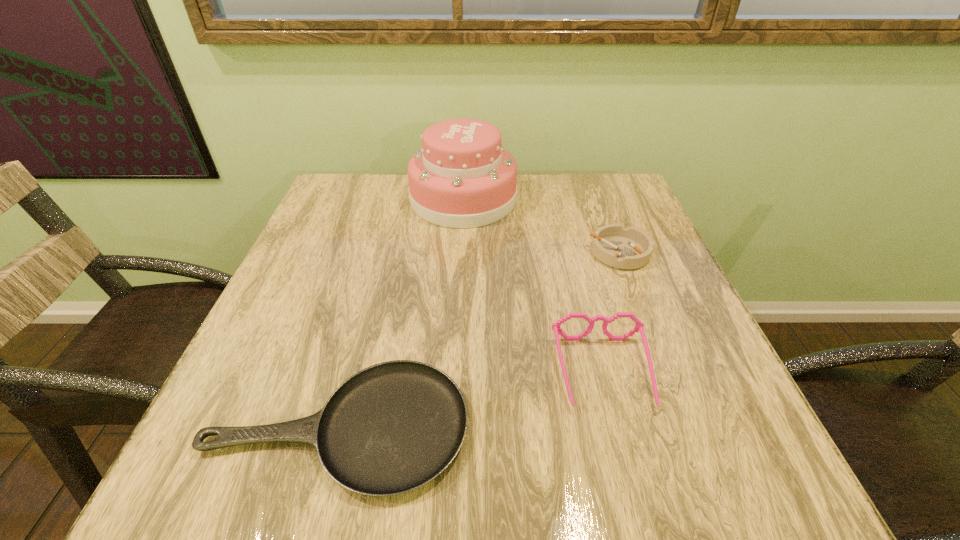
Where is `object that is at the far edge`? object that is at the far edge is located at coordinates (463, 177).

Locate an element on the screen. The height and width of the screenshot is (540, 960). object that is at the near edge is located at coordinates (391, 428).

Where is `object positioned at the left edge`? object positioned at the left edge is located at coordinates (391, 428).

You are a GUI agent. You are given a task and a screenshot of the screen. Output one action in this format:
    pyautogui.click(x=<x>, y=<y>)
    Task: Click on the spectacles that is positioned at the right edge
    
    Given the screenshot: What is the action you would take?
    pyautogui.click(x=639, y=326)

Locate an element on the screen. The width and height of the screenshot is (960, 540). ashtray present at the right edge is located at coordinates (625, 248).

What are the coordinates of `object situated at the near left corner` in the screenshot? It's located at (391, 428).

This screenshot has width=960, height=540. I want to click on vacant point at the far edge, so click(520, 207).

Identify the location of vacant point at the near edge. This screenshot has width=960, height=540. (300, 468).

What are the coordinates of `free spot at the left edge of the desktop` in the screenshot? It's located at (265, 327).

Locate an element on the screen. free space at the right edge of the desktop is located at coordinates (656, 241).